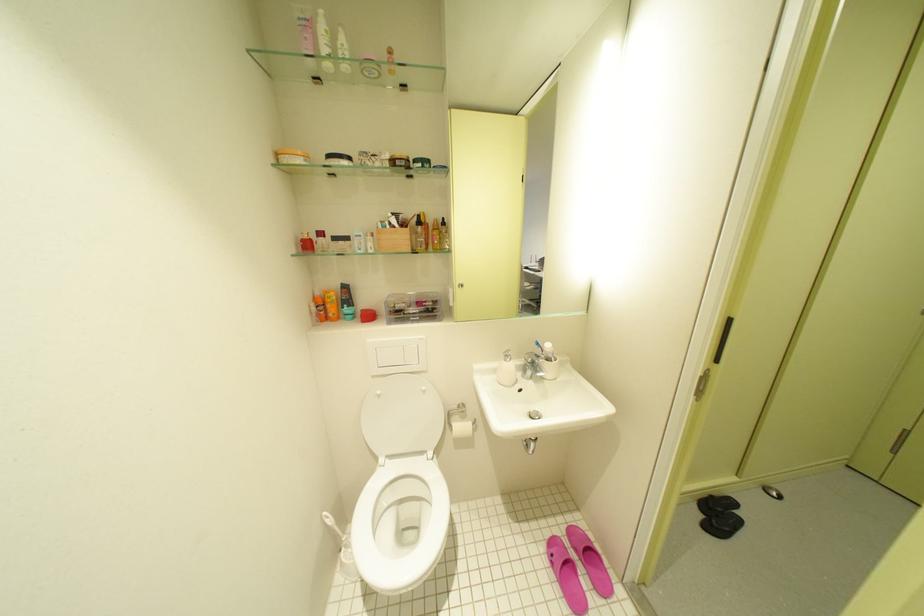
What do you see at coordinates (723, 339) in the screenshot?
I see `the black door handle` at bounding box center [723, 339].